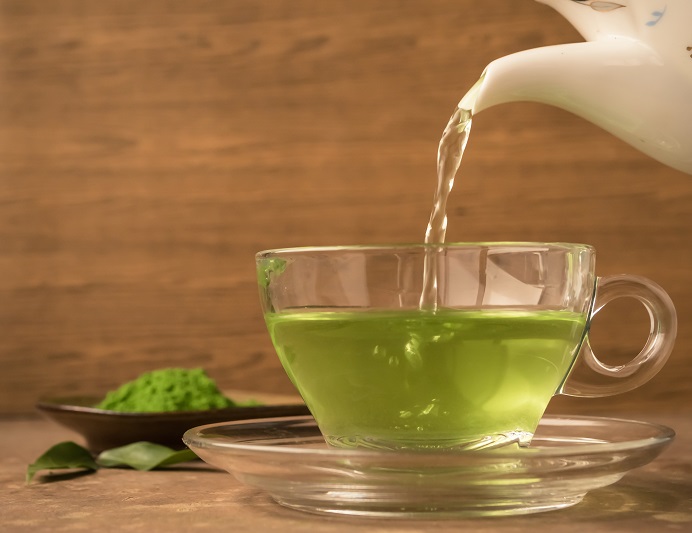
Find the location of a particular element. wooden surface is located at coordinates (118, 512).